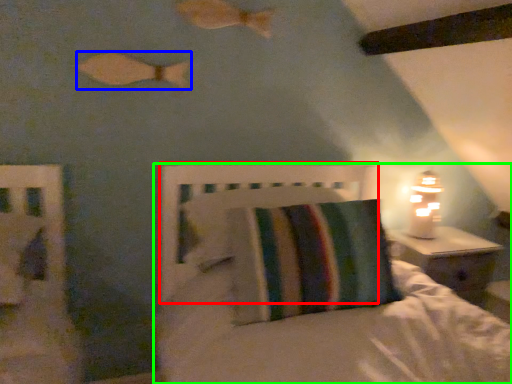
Question: Considering the real-world distances, which object is farthest from headboard (highlighted by a red box)? fish (highlighted by a blue box) or bed (highlighted by a green box)?

Choices:
 (A) fish
 (B) bed

Answer: (A)